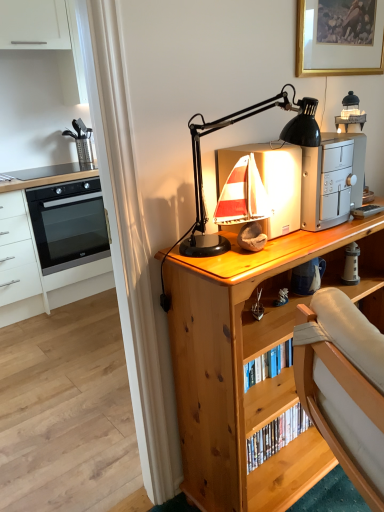
Question: Is black plastic lamp at upper center outside white glossy oven at left?

Choices:
 (A) no
 (B) yes

Answer: (B)

Question: From a real-world perspective, is black plastic lamp at upper center positioned over white glossy oven at left based on gravity?

Choices:
 (A) yes
 (B) no

Answer: (A)

Question: Is black plastic lamp at upper center oriented away from white glossy oven at left?

Choices:
 (A) yes
 (B) no

Answer: (A)

Question: Is black plastic lamp at upper center bigger than white glossy oven at left?

Choices:
 (A) no
 (B) yes

Answer: (A)

Question: Is black plastic lamp at upper center positioned behind white glossy oven at left?

Choices:
 (A) no
 (B) yes

Answer: (A)

Question: Can you see black plastic lamp at upper center touching white glossy oven at left?

Choices:
 (A) no
 (B) yes

Answer: (A)

Question: Considering the relative positions of white glossy oven at left and silver metallic toaster at upper right, the second appliance positioned from the left, in the image provided, is white glossy oven at left to the right of silver metallic toaster at upper right, the second appliance positioned from the left, from the viewer's perspective?

Choices:
 (A) yes
 (B) no

Answer: (B)

Question: Is white glossy oven at left positioned far away from silver metallic toaster at upper right, marked as the second appliance in a right-to-left arrangement?

Choices:
 (A) no
 (B) yes

Answer: (B)

Question: Can you confirm if white glossy oven at left is shorter than silver metallic toaster at upper right, marked as the second appliance in a right-to-left arrangement?

Choices:
 (A) no
 (B) yes

Answer: (A)

Question: Is white glossy oven at left facing away from silver metallic toaster at upper right, the second appliance positioned from the left?

Choices:
 (A) yes
 (B) no

Answer: (B)

Question: Can silver metallic toaster at upper right, the second appliance positioned from the left, be found inside white glossy oven at left?

Choices:
 (A) yes
 (B) no

Answer: (B)

Question: Is white glossy oven at left in contact with silver metallic toaster at upper right, the second appliance positioned from the left?

Choices:
 (A) yes
 (B) no

Answer: (B)

Question: Is silver metallic toaster at upper right, marked as the second appliance in a right-to-left arrangement, turned away from white ceramic lighthouse at right, placed as the 3th appliance when sorted from left to right?

Choices:
 (A) no
 (B) yes

Answer: (A)